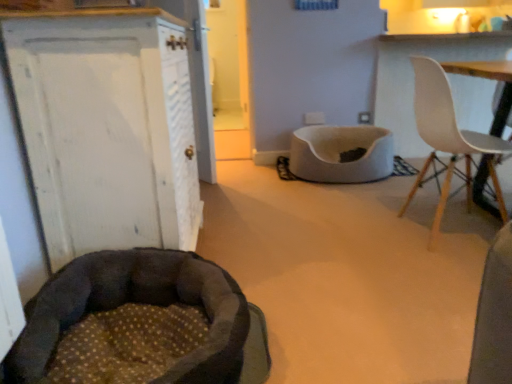
This screenshot has width=512, height=384. What do you see at coordinates (341, 152) in the screenshot? I see `white soft pet bed at center` at bounding box center [341, 152].

This screenshot has height=384, width=512. I want to click on white painted wood cabinet at left, so click(x=106, y=128).

Can you confirm if white soft pet bed at center is bigger than white painted wood cabinet at left?

No, white soft pet bed at center is not bigger than white painted wood cabinet at left.

Is white painted wood cabinet at left completely or partially inside white soft pet bed at center?

That's incorrect, white painted wood cabinet at left is not inside white soft pet bed at center.

From the image's perspective, is white soft pet bed at center positioned above or below white painted wood cabinet at left?

white soft pet bed at center is above white painted wood cabinet at left.

Considering the positions of point (136, 265) and point (392, 145), is point (136, 265) closer or farther from the camera than point (392, 145)?

Point (136, 265) appears to be closer to the viewer than point (392, 145).

From the picture: From a real-world perspective, is dark brown plush dog bed at lower left positioned above or below white soft pet bed at center?

dark brown plush dog bed at lower left is above white soft pet bed at center.

Who is smaller, dark brown plush dog bed at lower left or white soft pet bed at center?

With smaller size is dark brown plush dog bed at lower left.

Is dark brown plush dog bed at lower left positioned far away from white soft pet bed at center?

Yes, dark brown plush dog bed at lower left and white soft pet bed at center are quite far apart.

Does white painted wood cabinet at left have a lesser height compared to white plastic chair at upper right?

In fact, white painted wood cabinet at left may be taller than white plastic chair at upper right.

Can you confirm if white painted wood cabinet at left is thinner than white plastic chair at upper right?

Yes, white painted wood cabinet at left is thinner than white plastic chair at upper right.

Considering the relative sizes of white painted wood cabinet at left and white plastic chair at upper right in the image provided, is white painted wood cabinet at left bigger than white plastic chair at upper right?

Yes, white painted wood cabinet at left is bigger than white plastic chair at upper right.

Can we say dark brown plush dog bed at lower left lies outside white plastic chair at upper right?

Yes, dark brown plush dog bed at lower left is located beyond the bounds of white plastic chair at upper right.

Is dark brown plush dog bed at lower left in front of or behind white plastic chair at upper right in the image?

dark brown plush dog bed at lower left is positioned closer to the viewer than white plastic chair at upper right.

From the image's perspective, which is below, dark brown plush dog bed at lower left or white plastic chair at upper right?

dark brown plush dog bed at lower left appears lower in the image.

Who is taller, dark brown plush dog bed at lower left or white plastic chair at upper right?

white plastic chair at upper right is taller.

Does white soft pet bed at center appear on the right side of dark brown plush dog bed at lower left?

Correct, you'll find white soft pet bed at center to the right of dark brown plush dog bed at lower left.

Are white soft pet bed at center and dark brown plush dog bed at lower left making contact?

No.

Considering the positions of objects white soft pet bed at center and dark brown plush dog bed at lower left in the image provided, who is behind, white soft pet bed at center or dark brown plush dog bed at lower left?

white soft pet bed at center is further away from the camera.

How different are the orientations of white painted wood cabinet at left and white soft pet bed at center in degrees?

The angular difference between white painted wood cabinet at left and white soft pet bed at center is 92.9 degrees.

Is white painted wood cabinet at left at the left side of white soft pet bed at center?

Yes.

Which object is thinner, white painted wood cabinet at left or white soft pet bed at center?

white painted wood cabinet at left.

Is dark brown plush dog bed at lower left directly adjacent to white painted wood cabinet at left?

dark brown plush dog bed at lower left and white painted wood cabinet at left are not in contact.

Does point (198, 331) appear closer or farther from the camera than point (87, 73)?

Point (198, 331).

Is dark brown plush dog bed at lower left completely or partially outside of white painted wood cabinet at left?

Indeed, dark brown plush dog bed at lower left is completely outside white painted wood cabinet at left.

Does dark brown plush dog bed at lower left turn towards white painted wood cabinet at left?

No, dark brown plush dog bed at lower left is not turned towards white painted wood cabinet at left.

Where is `cat bed on the right side of white painted wood cabinet at left`? The height and width of the screenshot is (384, 512). cat bed on the right side of white painted wood cabinet at left is located at coordinates (341, 152).

The image size is (512, 384). Find the location of `cat bed that appears behind the dark brown plush dog bed at lower left`. cat bed that appears behind the dark brown plush dog bed at lower left is located at coordinates (341, 152).

From the image, which object appears to be farther from white plastic chair at upper right, dark brown plush dog bed at lower left or white soft pet bed at center?

The object further to white plastic chair at upper right is dark brown plush dog bed at lower left.

When comparing their distances from white soft pet bed at center, does white plastic chair at upper right or dark brown plush dog bed at lower left seem closer?

white plastic chair at upper right lies closer to white soft pet bed at center than the other object.

Considering their positions, is dark brown plush dog bed at lower left positioned further to white plastic chair at upper right than white painted wood cabinet at left?

Among the two, white painted wood cabinet at left is located further to white plastic chair at upper right.

Which object lies nearer to the anchor point dark brown plush dog bed at lower left, white painted wood cabinet at left or white soft pet bed at center?

The object closer to dark brown plush dog bed at lower left is white painted wood cabinet at left.

Looking at the image, which one is located further to white painted wood cabinet at left, white plastic chair at upper right or dark brown plush dog bed at lower left?

white plastic chair at upper right.

Estimate the real-world distances between objects in this image. Which object is further from white plastic chair at upper right, white soft pet bed at center or dark brown plush dog bed at lower left?

dark brown plush dog bed at lower left is further to white plastic chair at upper right.

Looking at the image, which one is located further to white painted wood cabinet at left, white plastic chair at upper right or white soft pet bed at center?

Based on the image, white soft pet bed at center appears to be further to white painted wood cabinet at left.

Estimate the real-world distances between objects in this image. Which object is further from white plastic chair at upper right, white painted wood cabinet at left or white soft pet bed at center?

white painted wood cabinet at left is further to white plastic chair at upper right.

The height and width of the screenshot is (384, 512). I want to click on dog bed between white painted wood cabinet at left and white plastic chair at upper right from left to right, so click(140, 324).

Where is `cabinetry positioned between dark brown plush dog bed at lower left and white soft pet bed at center from near to far`? cabinetry positioned between dark brown plush dog bed at lower left and white soft pet bed at center from near to far is located at coordinates (106, 128).

Where is `chair positioned between dark brown plush dog bed at lower left and white soft pet bed at center from near to far`? Image resolution: width=512 pixels, height=384 pixels. chair positioned between dark brown plush dog bed at lower left and white soft pet bed at center from near to far is located at coordinates tap(449, 142).

In order to click on chair positioned between white painted wood cabinet at left and white soft pet bed at center from near to far in this screenshot , I will do `click(449, 142)`.